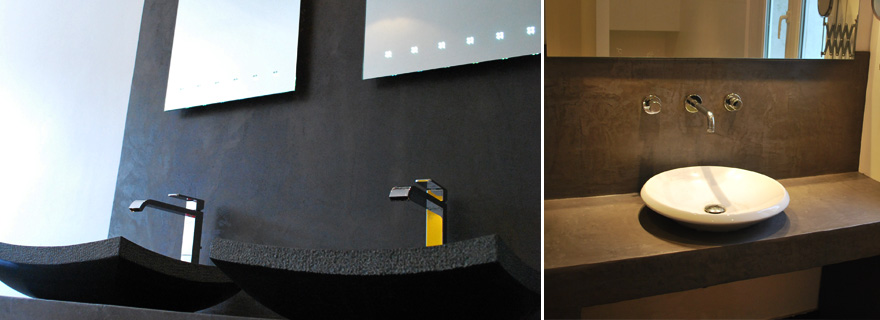
Locate an element on the screen. The height and width of the screenshot is (320, 880). counter is located at coordinates (92, 309), (619, 252).